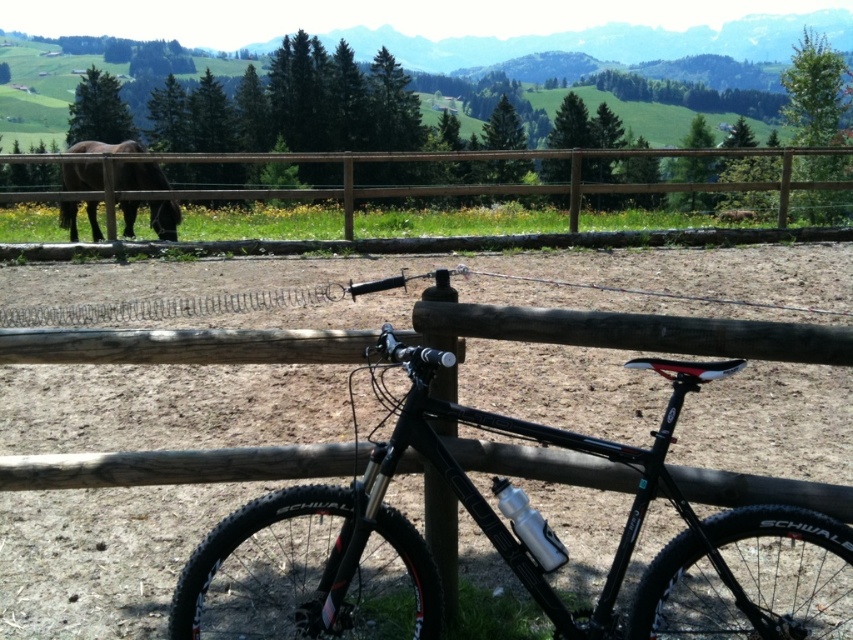
You are a photographer setting up a shot of the black matte mountain bike at center and the brown matte horse at left. You want to ensure both subjects are in the frame. Based on their positions, which subject should be placed closer to the left edge of the photo?

The brown matte horse at left should be placed closer to the left edge of the photo because it is positioned to the left of the black matte mountain bike at center.

You are a photographer setting up a tripod to capture the brown wooden fence at upper center and the brown matte horse at left. Since the fence is in front of the horse, will the horse be partially obscured in the photo?

Yes, the horse will be partially obscured because the brown wooden fence at upper center is positioned over the brown matte horse at left, meaning the fence is in front and may block part of the horse from view.